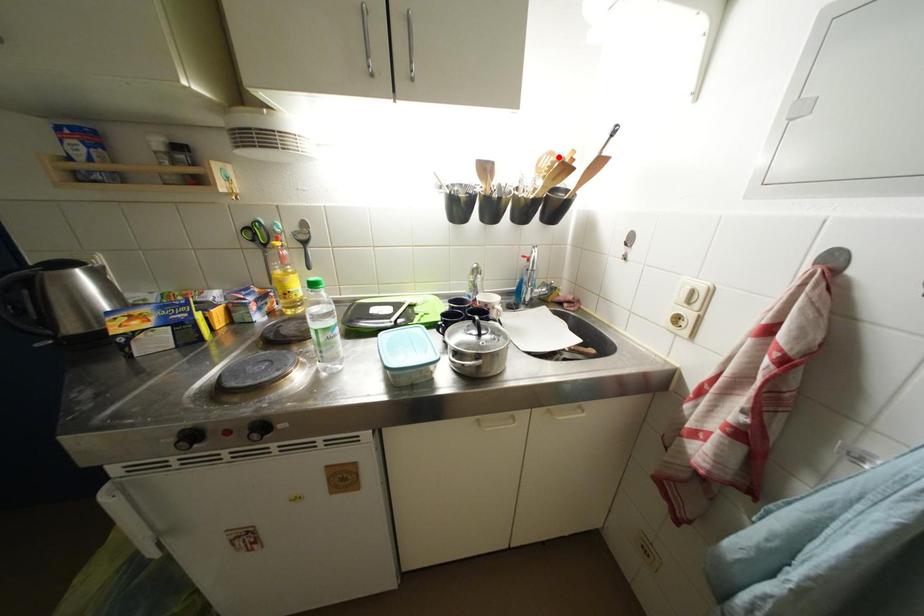
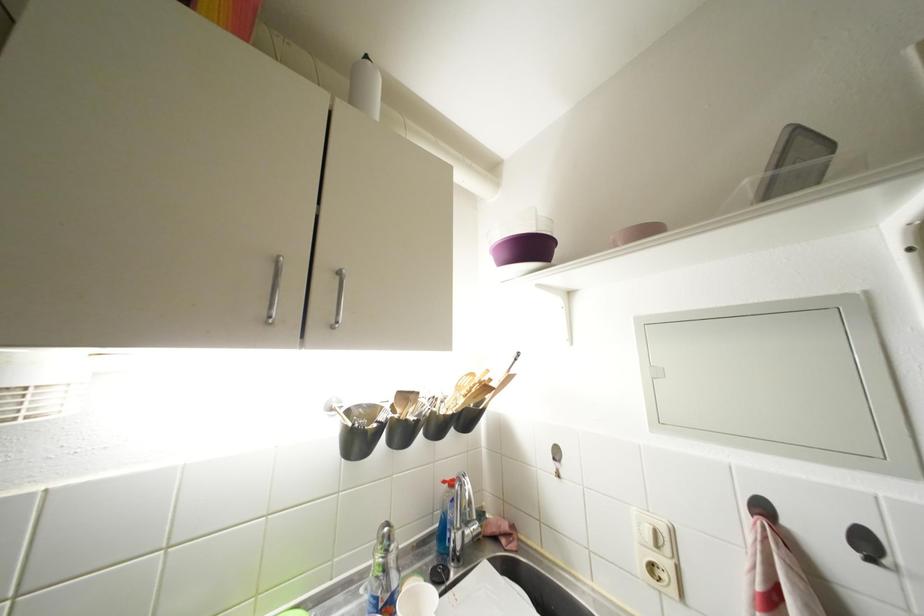
In the second image, find the point that corresponds to the highlighted location in the first image.

(479, 379)